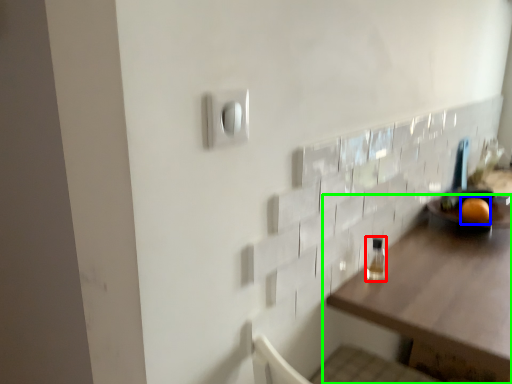
Question: Which is nearer to the bottle (highlighted by a red box)? orange (highlighted by a blue box) or table (highlighted by a green box).

Choices:
 (A) orange
 (B) table

Answer: (B)